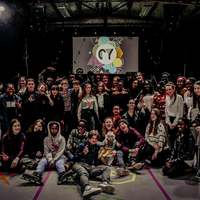
Where is `studio`? studio is located at coordinates (71, 54).